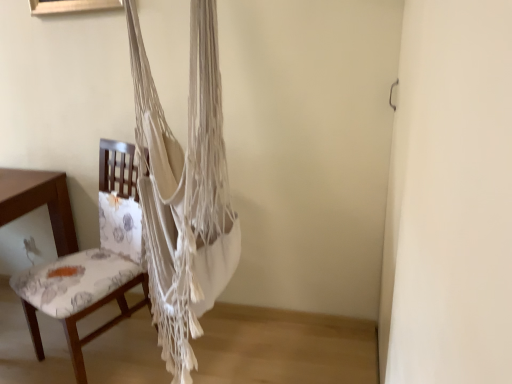
Question: Does floral fabric chair at left lie in front of white macrame hammock at center?

Choices:
 (A) yes
 (B) no

Answer: (B)

Question: Can you confirm if floral fabric chair at left is taller than white macrame hammock at center?

Choices:
 (A) yes
 (B) no

Answer: (B)

Question: Would you say floral fabric chair at left contains white macrame hammock at center?

Choices:
 (A) yes
 (B) no

Answer: (B)

Question: Is floral fabric chair at left facing towards white macrame hammock at center?

Choices:
 (A) yes
 (B) no

Answer: (B)

Question: From a real-world perspective, is floral fabric chair at left physically above white macrame hammock at center?

Choices:
 (A) no
 (B) yes

Answer: (A)

Question: Is floral fabric chair at left smaller than white macrame hammock at center?

Choices:
 (A) no
 (B) yes

Answer: (B)

Question: From the image's perspective, is white macrame hammock at center located beneath floral fabric chair at left?

Choices:
 (A) yes
 (B) no

Answer: (B)

Question: From the image's perspective, does white macrame hammock at center appear higher than floral fabric chair at left?

Choices:
 (A) no
 (B) yes

Answer: (B)

Question: Can you confirm if white macrame hammock at center is positioned to the left of floral fabric chair at left?

Choices:
 (A) yes
 (B) no

Answer: (B)

Question: Does white macrame hammock at center have a greater width compared to floral fabric chair at left?

Choices:
 (A) yes
 (B) no

Answer: (B)

Question: Considering the relative sizes of white macrame hammock at center and floral fabric chair at left in the image provided, is white macrame hammock at center shorter than floral fabric chair at left?

Choices:
 (A) yes
 (B) no

Answer: (B)

Question: Is white macrame hammock at center outside of floral fabric chair at left?

Choices:
 (A) no
 (B) yes

Answer: (B)

Question: Is white macrame hammock at center spatially inside floral fabric chair at left, or outside of it?

Choices:
 (A) inside
 (B) outside

Answer: (B)